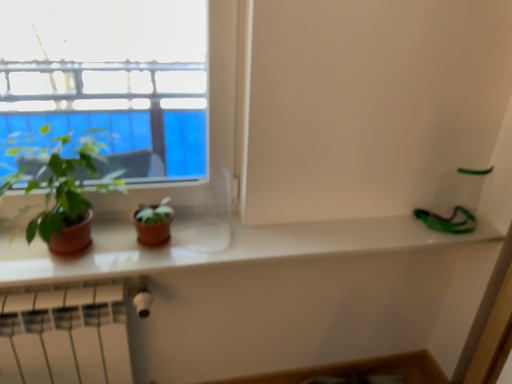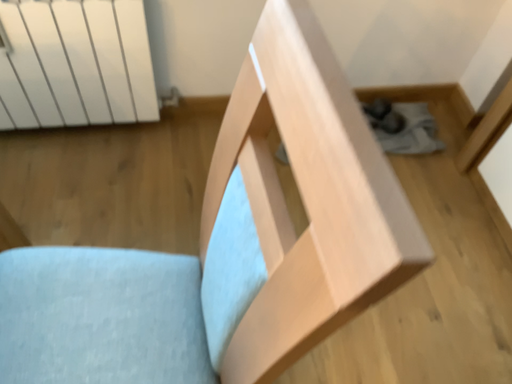
Question: Which way did the camera rotate in the video?

Choices:
 (A) rotated downward
 (B) rotated upward

Answer: (A)